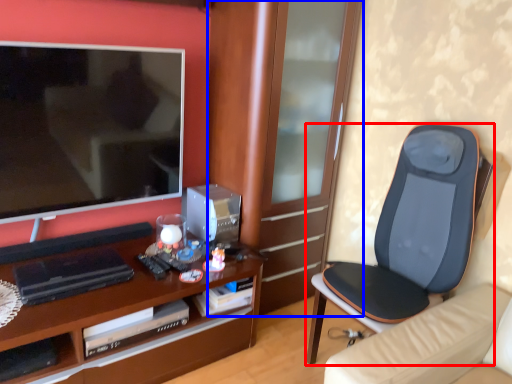
Question: Which of the following is the closest to the observer, chair (highlighted by a red box) or cabinetry (highlighted by a blue box)?

Choices:
 (A) chair
 (B) cabinetry

Answer: (A)